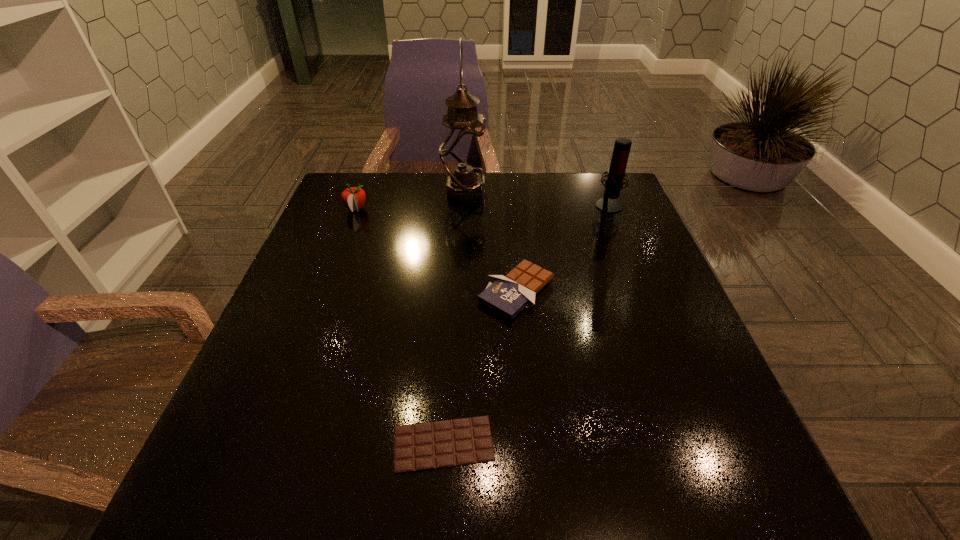
Locate an element on the screen. empty space that is in between the microphone and the tallest object is located at coordinates (537, 198).

Where is `free space between the third shortest object and the rightmost object`? This screenshot has width=960, height=540. free space between the third shortest object and the rightmost object is located at coordinates (483, 207).

Locate an element on the screen. free space between the fourth shortest object and the farther chocolate bar is located at coordinates (563, 248).

Identify the location of vacant area that lies between the oil lamp and the nearest object. The width and height of the screenshot is (960, 540). (454, 318).

What are the coordinates of `free spot between the tallest object and the taller chocolate bar` in the screenshot? It's located at (491, 241).

Locate an element on the screen. This screenshot has height=540, width=960. vacant area that lies between the rightmost object and the third shortest object is located at coordinates (483, 207).

Identify the location of vacant area that lies between the microphone and the second nearest object. [563, 248].

This screenshot has height=540, width=960. What are the coordinates of `vacant point located between the rightmost object and the nearest object` in the screenshot? It's located at (526, 324).

Identify the location of free point between the shorter chocolate bar and the third tallest object. (400, 327).

The image size is (960, 540). In order to click on object that is the third closest one to the nearer chocolate bar in this screenshot , I will do `click(462, 152)`.